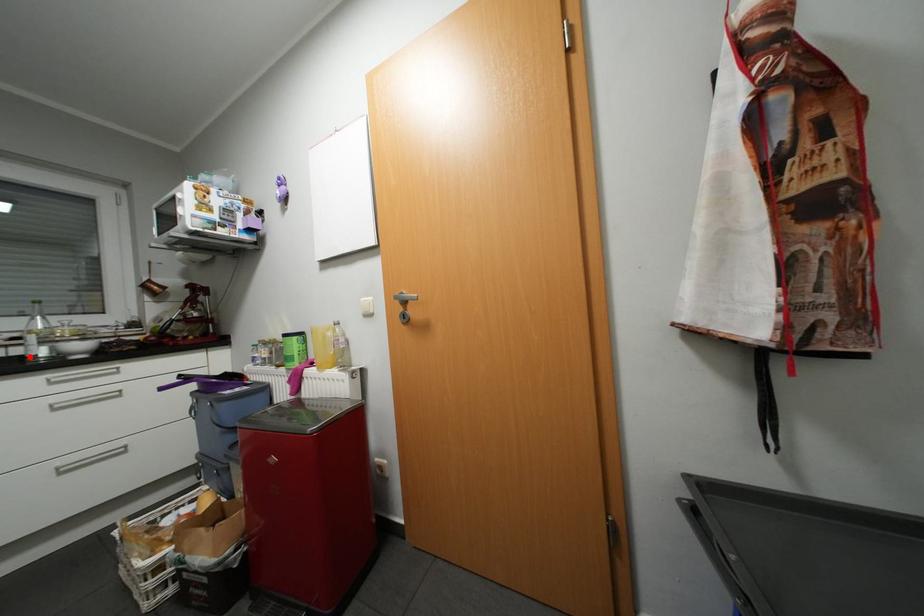
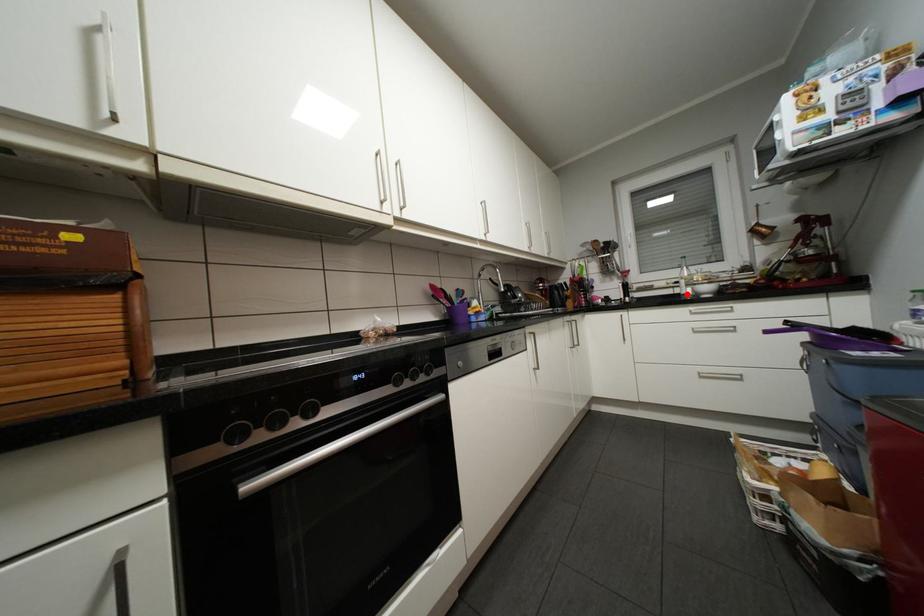
I am providing you with two images of the same scene from different viewpoints. A red point is marked on the first image and another point is marked on the second image. Is the marked point in image1 the same physical position as the marked point in image2?

Yes